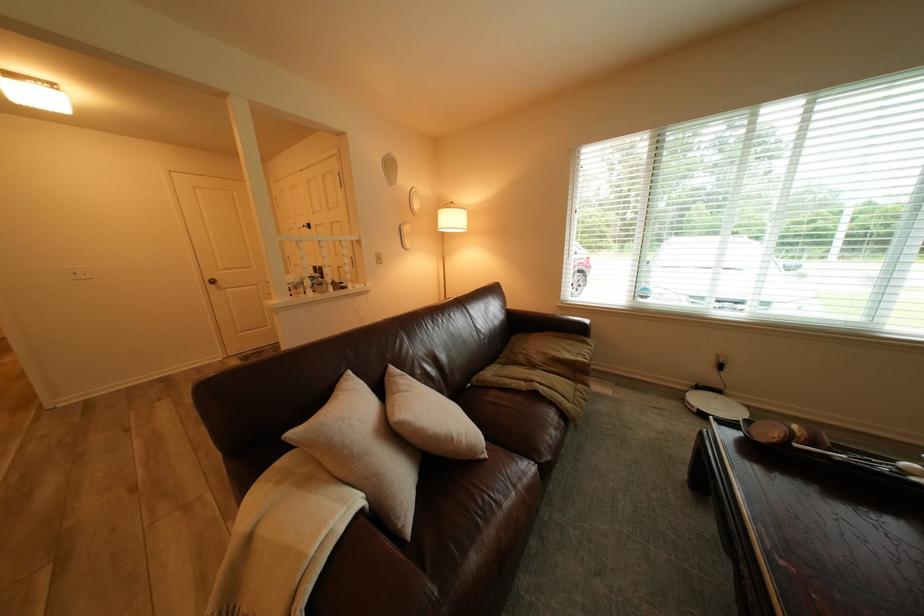
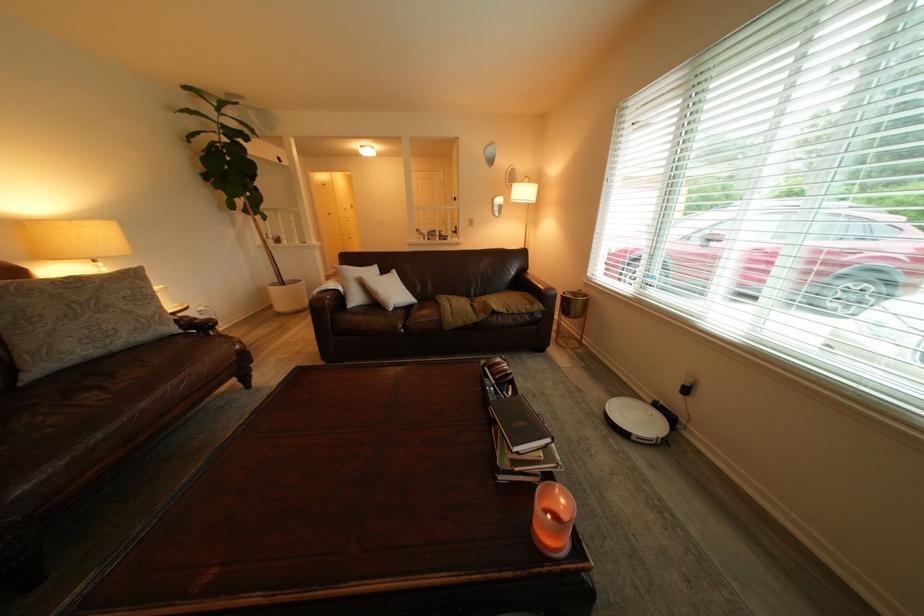
Find the pixel in the second image that matches point 393,259 in the first image.

(484, 223)